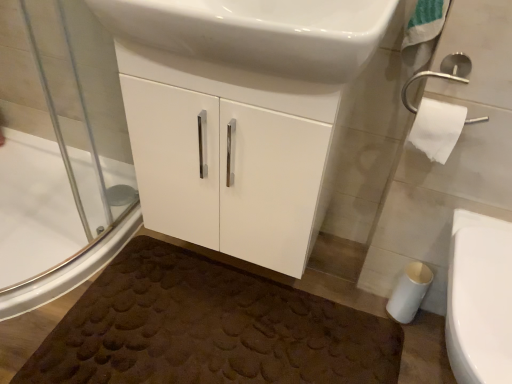
This screenshot has height=384, width=512. Describe the element at coordinates (258, 32) in the screenshot. I see `white glossy sink at upper center` at that location.

What is the approximate width of white paper at upper right, which is the 1th toilet paper from front to back?

4.95 inches.

Locate an element on the screen. This screenshot has width=512, height=384. white glossy bidet at lower right is located at coordinates (480, 299).

Which object is thinner, white paper at upper right, arranged as the second toilet paper when ordered from the bottom, or white glossy bidet at lower right?

white paper at upper right, arranged as the second toilet paper when ordered from the bottom, is thinner.

Which object is more forward, white paper at upper right, arranged as the second toilet paper when ordered from the bottom, or white glossy bidet at lower right?

white glossy bidet at lower right is closer to the camera.

Is point (445, 138) farther from camera compared to point (454, 271)?

Yes, it is behind point (454, 271).

Would you say white glossy bidet at lower right is part of white paper at upper right, arranged as the second toilet paper when ordered from the bottom,'s contents?

Actually, white glossy bidet at lower right is outside white paper at upper right, arranged as the second toilet paper when ordered from the bottom.

Does white glossy sink at upper center come in front of white glossy cabinet at center?

Yes, white glossy sink at upper center is closer to the viewer.

Which is more to the right, white glossy sink at upper center or white glossy cabinet at center?

From the viewer's perspective, white glossy sink at upper center appears more on the right side.

Can you confirm if white glossy sink at upper center is taller than white glossy cabinet at center?

No, white glossy sink at upper center is not taller than white glossy cabinet at center.

From a real-world perspective, is white glossy sink at upper center positioned under white glossy cabinet at center based on gravity?

No, from a real-world perspective, white glossy sink at upper center is not below white glossy cabinet at center.

From the image's perspective, is white matte toilet paper at lower right, arranged as the 2th toilet paper when viewed from the front, located above transparent glass shower door at left?

No, from the image's perspective, white matte toilet paper at lower right, arranged as the 2th toilet paper when viewed from the front, is not above transparent glass shower door at left.

How far apart are white matte toilet paper at lower right, the 2th toilet paper in the top-to-bottom sequence, and transparent glass shower door at left?

The distance of white matte toilet paper at lower right, the 2th toilet paper in the top-to-bottom sequence, from transparent glass shower door at left is 3.95 feet.

Does point (411, 281) appear closer or farther from the camera than point (42, 21)?

Point (411, 281) is positioned farther from the camera compared to point (42, 21).

Considering the sizes of objects white matte toilet paper at lower right, which is counted as the first toilet paper, starting from the back, and transparent glass shower door at left in the image provided, who is bigger, white matte toilet paper at lower right, which is counted as the first toilet paper, starting from the back, or transparent glass shower door at left?

transparent glass shower door at left is bigger.

Considering the sizes of white glossy bidet at lower right and brown textured bath mat at lower center in the image, is white glossy bidet at lower right wider or thinner than brown textured bath mat at lower center?

white glossy bidet at lower right is thinner than brown textured bath mat at lower center.

Based on the photo, is white glossy bidet at lower right facing towards brown textured bath mat at lower center?

No, white glossy bidet at lower right is not aimed at brown textured bath mat at lower center.

Is white glossy bidet at lower right in front of brown textured bath mat at lower center?

Yes, white glossy bidet at lower right is closer to the viewer.

Are white glossy bidet at lower right and brown textured bath mat at lower center far apart?

white glossy bidet at lower right is actually quite close to brown textured bath mat at lower center.

Is point (429, 276) positioned behind point (472, 330)?

Yes, point (429, 276) is farther from viewer.

Considering the sizes of objects white matte toilet paper at lower right, the 2th toilet paper in the top-to-bottom sequence, and white glossy bidet at lower right in the image provided, who is thinner, white matte toilet paper at lower right, the 2th toilet paper in the top-to-bottom sequence, or white glossy bidet at lower right?

With smaller width is white matte toilet paper at lower right, the 2th toilet paper in the top-to-bottom sequence.

This screenshot has width=512, height=384. Identify the location of bidet on the right of white matte toilet paper at lower right, arranged as the 2th toilet paper when viewed from the front. (480, 299).

Considering the sizes of white matte toilet paper at lower right, the 2th toilet paper in the top-to-bottom sequence, and white glossy bidet at lower right in the image, is white matte toilet paper at lower right, the 2th toilet paper in the top-to-bottom sequence, taller or shorter than white glossy bidet at lower right?

Considering their sizes, white matte toilet paper at lower right, the 2th toilet paper in the top-to-bottom sequence, has less height than white glossy bidet at lower right.

Which of these two, brown textured bath mat at lower center or white paper at upper right, which is the 1th toilet paper from front to back, is bigger?

Bigger between the two is brown textured bath mat at lower center.

Are brown textured bath mat at lower center and white paper at upper right, arranged as the second toilet paper when ordered from the bottom, far apart?

Actually, brown textured bath mat at lower center and white paper at upper right, arranged as the second toilet paper when ordered from the bottom, are a little close together.

Is brown textured bath mat at lower center positioned with its back to white paper at upper right, which is the 1th toilet paper from front to back?

No.

How different are the orientations of brown textured bath mat at lower center and white paper at upper right, which is the 1th toilet paper from front to back, in degrees?

brown textured bath mat at lower center and white paper at upper right, which is the 1th toilet paper from front to back, are facing 7.34 degrees away from each other.

Is brown textured bath mat at lower center bigger than transparent glass shower door at left?

No.

Considering the points (148, 334) and (45, 197), which point is behind, point (148, 334) or point (45, 197)?

Positioned behind is point (45, 197).

Would you say brown textured bath mat at lower center is to the left or to the right of transparent glass shower door at left in the picture?

From the image, it's evident that brown textured bath mat at lower center is to the right of transparent glass shower door at left.

Is brown textured bath mat at lower center oriented away from transparent glass shower door at left?

No, transparent glass shower door at left is not at the back of brown textured bath mat at lower center.

Find the location of `bidet lying on the right of white paper at upper right, which is the 1th toilet paper from front to back`. bidet lying on the right of white paper at upper right, which is the 1th toilet paper from front to back is located at coordinates (480, 299).

At what (x,y) coordinates should I click in order to perform the action: click on sink above the white glossy cabinet at center (from the image's perspective). Please return your answer as a coordinate pair (x, y). Looking at the image, I should click on (258, 32).

Estimate the real-world distances between objects in this image. Which object is closer to white glossy sink at upper center, white glossy bidet at lower right or white glossy cabinet at center?

white glossy cabinet at center lies closer to white glossy sink at upper center than the other object.

Estimate the real-world distances between objects in this image. Which object is further from white paper at upper right, the 1th toilet paper when ordered from top to bottom, white glossy cabinet at center or white glossy bidet at lower right?

Based on the image, white glossy cabinet at center appears to be further to white paper at upper right, the 1th toilet paper when ordered from top to bottom.

Which object lies further to the anchor point white glossy bidet at lower right, white matte toilet paper at lower right, arranged as the 1th toilet paper when ordered from the bottom, or white paper at upper right, arranged as the second toilet paper when ordered from the bottom?

The object further to white glossy bidet at lower right is white matte toilet paper at lower right, arranged as the 1th toilet paper when ordered from the bottom.

Looking at the image, which one is located further to white glossy sink at upper center, white matte toilet paper at lower right, arranged as the 2th toilet paper when viewed from the front, or white glossy bidet at lower right?

white matte toilet paper at lower right, arranged as the 2th toilet paper when viewed from the front, lies further to white glossy sink at upper center than the other object.

Which object lies nearer to the anchor point white glossy cabinet at center, white matte toilet paper at lower right, arranged as the 2th toilet paper when viewed from the front, or white glossy sink at upper center?

Among the two, white glossy sink at upper center is located nearer to white glossy cabinet at center.

Estimate the real-world distances between objects in this image. Which object is closer to brown textured bath mat at lower center, white matte toilet paper at lower right, the 2th toilet paper in the top-to-bottom sequence, or white glossy cabinet at center?

white glossy cabinet at center is positioned closer to the anchor brown textured bath mat at lower center.

In the scene shown: From the image, which object appears to be nearer to white matte toilet paper at lower right, which is counted as the first toilet paper, starting from the back, white glossy bidet at lower right or white paper at upper right, the second toilet paper positioned from the back?

The object closer to white matte toilet paper at lower right, which is counted as the first toilet paper, starting from the back, is white glossy bidet at lower right.

Estimate the real-world distances between objects in this image. Which object is closer to white glossy sink at upper center, white glossy cabinet at center or white glossy bidet at lower right?

white glossy cabinet at center is closer to white glossy sink at upper center.

The image size is (512, 384). Find the location of `bath mat situated between transparent glass shower door at left and white paper at upper right, which is the 1th toilet paper from front to back, from left to right`. bath mat situated between transparent glass shower door at left and white paper at upper right, which is the 1th toilet paper from front to back, from left to right is located at coordinates (208, 329).

At what (x,y) coordinates should I click in order to perform the action: click on sink between transparent glass shower door at left and white matte toilet paper at lower right, which is counted as the first toilet paper, starting from the back, from left to right. Please return your answer as a coordinate pair (x, y). Looking at the image, I should click on (258, 32).

Where is `bath mat situated between transparent glass shower door at left and white glossy bidet at lower right from left to right`? bath mat situated between transparent glass shower door at left and white glossy bidet at lower right from left to right is located at coordinates (208, 329).

What are the coordinates of `bath mat situated between transparent glass shower door at left and white matte toilet paper at lower right, arranged as the 2th toilet paper when viewed from the front, from left to right` in the screenshot? It's located at (208, 329).